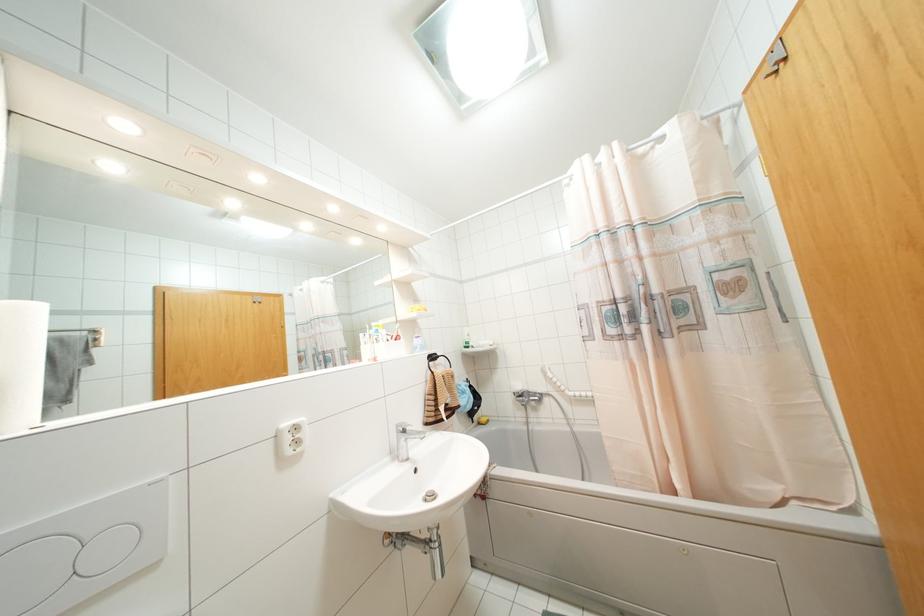
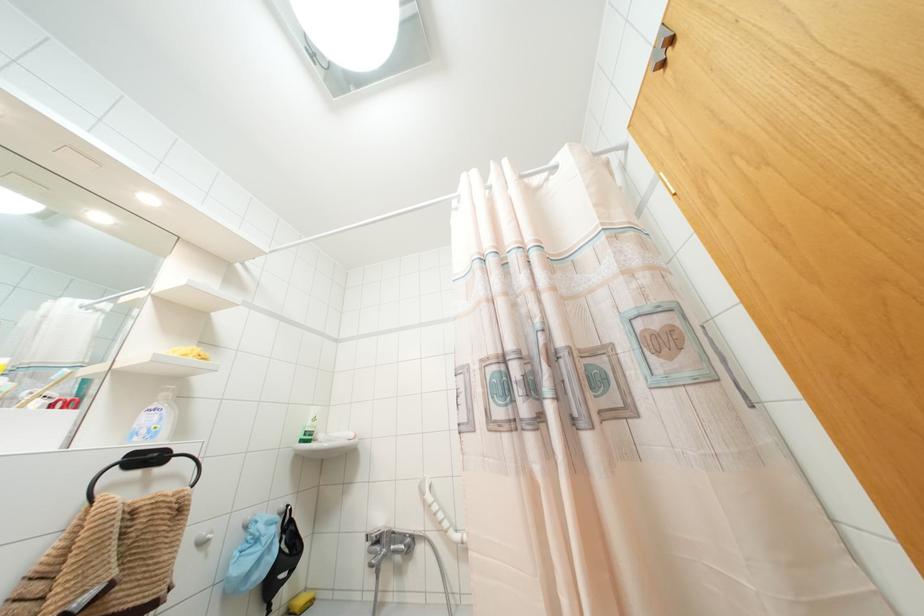
Locate, in the second image, the point that corresponds to [468,334] in the first image.

(312, 419)